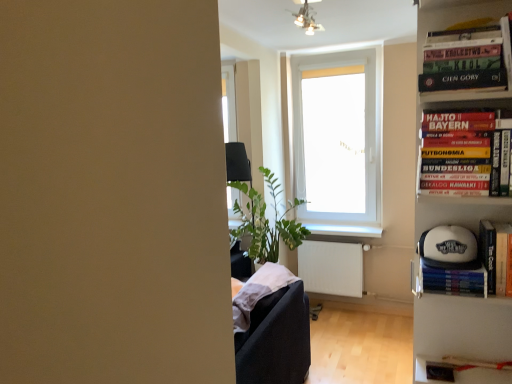
Where is `empty space that is ontop of white glossy window sill at center (from a real-world perspective)`? empty space that is ontop of white glossy window sill at center (from a real-world perspective) is located at coordinates (340, 227).